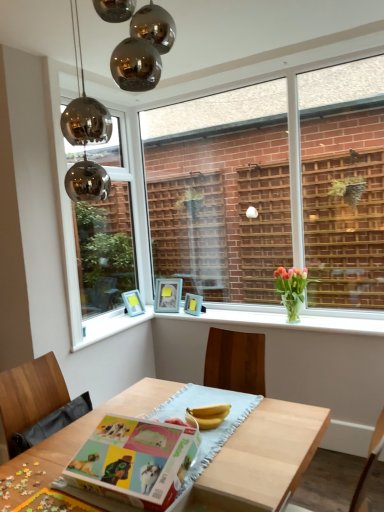
I want to click on unoccupied area in front of matte blue picture frame at center, marked as the third picture frame in a left-to-right arrangement, so click(208, 316).